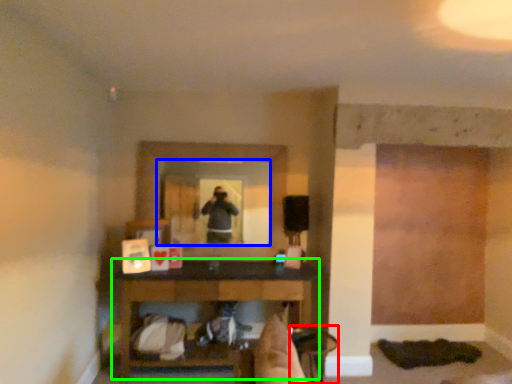
Question: Which object is the closest to the chair (highlighted by a red box)? Choose among these: mirror (highlighted by a blue box) or table (highlighted by a green box).

Choices:
 (A) mirror
 (B) table

Answer: (B)